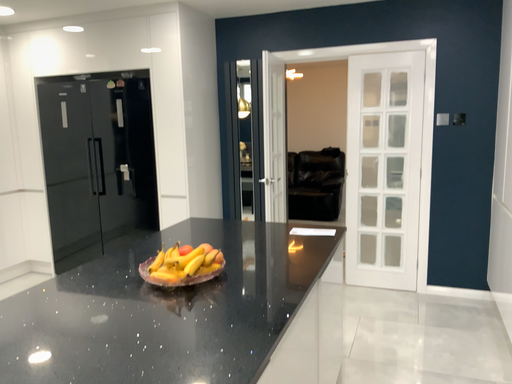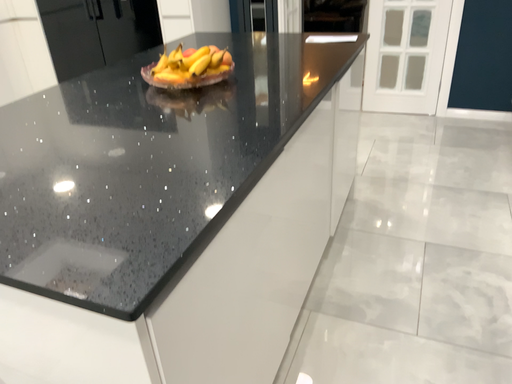
Question: Which way did the camera rotate in the video?

Choices:
 (A) rotated upward
 (B) rotated downward

Answer: (B)